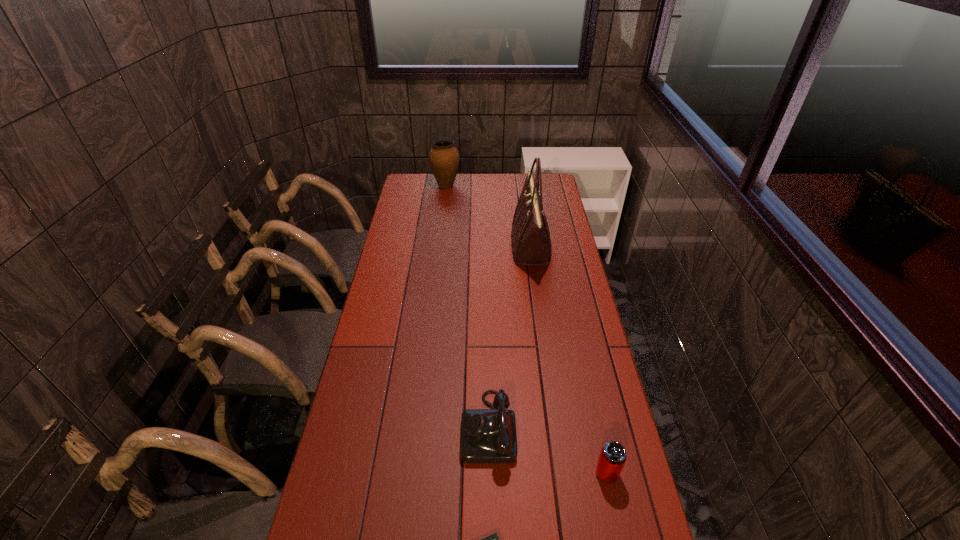
The image size is (960, 540). Find the location of `free space that satisfies the following two spatial constraints: 1. on the dial of the telephone; 2. on the right side of the soda can`. free space that satisfies the following two spatial constraints: 1. on the dial of the telephone; 2. on the right side of the soda can is located at coordinates (489, 473).